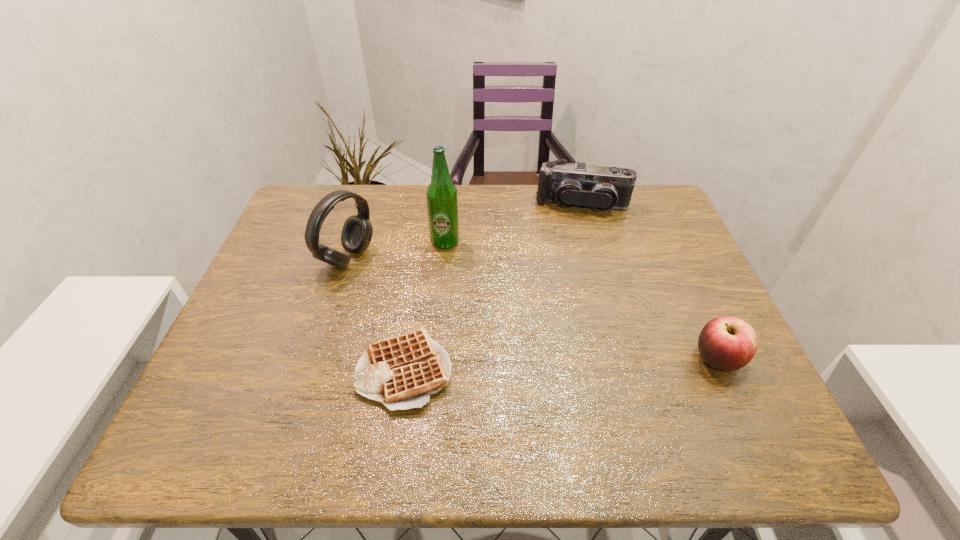
At what (x,y) coordinates should I click in order to perform the action: click on vacant space located 0.060m on the front-facing side of the farthest object. Please return your answer as a coordinate pair (x, y). Looking at the image, I should click on (574, 230).

The height and width of the screenshot is (540, 960). I want to click on vacant space positioned 0.130m on the front-facing side of the farthest object, so 573,245.

Locate an element on the screen. blank space located 0.350m on the label of the tallest object is located at coordinates (525, 336).

At what (x,y) coordinates should I click in order to perform the action: click on vacant space situated 0.200m on the label of the tallest object. Please return your answer as a coordinate pair (x, y). This screenshot has width=960, height=540. Looking at the image, I should click on (491, 295).

The image size is (960, 540). I want to click on free location located 0.290m on the label of the tallest object, so (511, 319).

The image size is (960, 540). I want to click on free space located on the earcups of the fourth shortest object, so click(x=450, y=305).

The width and height of the screenshot is (960, 540). In order to click on blank space located 0.100m on the earcups of the fourth shortest object in this screenshot , I will do `click(397, 283)`.

Where is `blank area located 0.200m on the earcups of the fourth shortest object`? The height and width of the screenshot is (540, 960). blank area located 0.200m on the earcups of the fourth shortest object is located at coordinates (430, 296).

This screenshot has width=960, height=540. In order to click on object situated at the far edge in this screenshot , I will do `click(602, 188)`.

Where is `waffle that is at the near edge`? The width and height of the screenshot is (960, 540). waffle that is at the near edge is located at coordinates (401, 372).